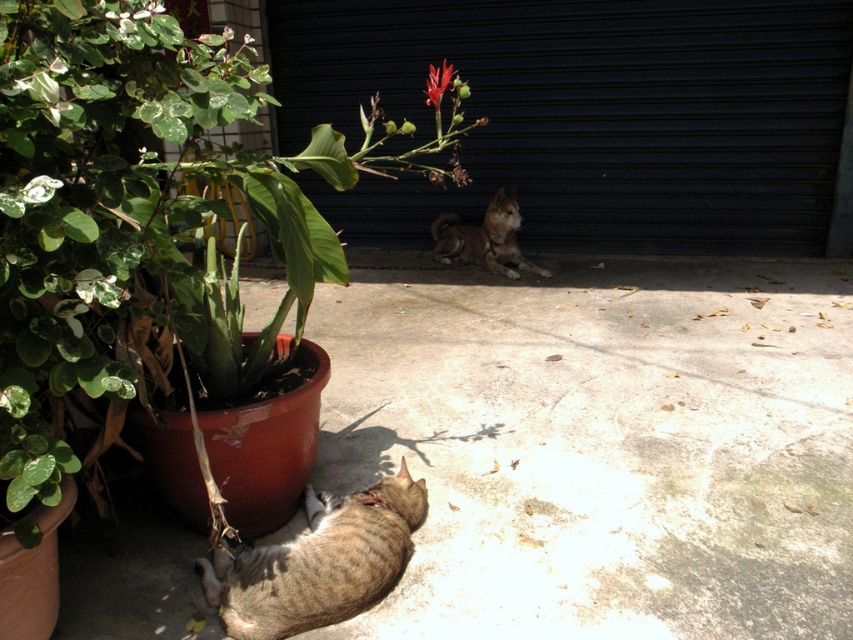
Question: Can you confirm if matte terracotta pot at lower left is positioned to the right of brown fur dog at center?

Choices:
 (A) no
 (B) yes

Answer: (A)

Question: Which object is farther from the camera taking this photo?

Choices:
 (A) black metal/gate at center
 (B) matte terracotta pot at lower left
 (C) brown fur dog at center
 (D) tabby fur cat at lower left

Answer: (C)

Question: Which point is farther to the camera?

Choices:
 (A) (508, 216)
 (B) (692, 74)

Answer: (B)

Question: Which of the following is the closest to the observer?

Choices:
 (A) (4, 170)
 (B) (410, 516)

Answer: (A)

Question: Can you confirm if matte terracotta pot at lower left is positioned below brown fur dog at center?

Choices:
 (A) yes
 (B) no

Answer: (A)

Question: Is matte terracotta pot at lower left thinner than vivid red petal at upper center?

Choices:
 (A) no
 (B) yes

Answer: (A)